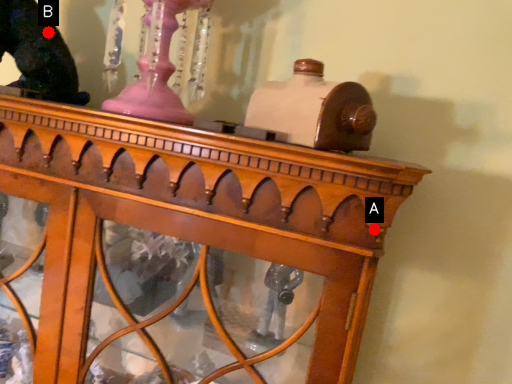
Question: Two points are circled on the image, labeled by A and B beside each circle. Which of the following is the closest to the observer?

Choices:
 (A) A is closer
 (B) B is closer

Answer: (A)